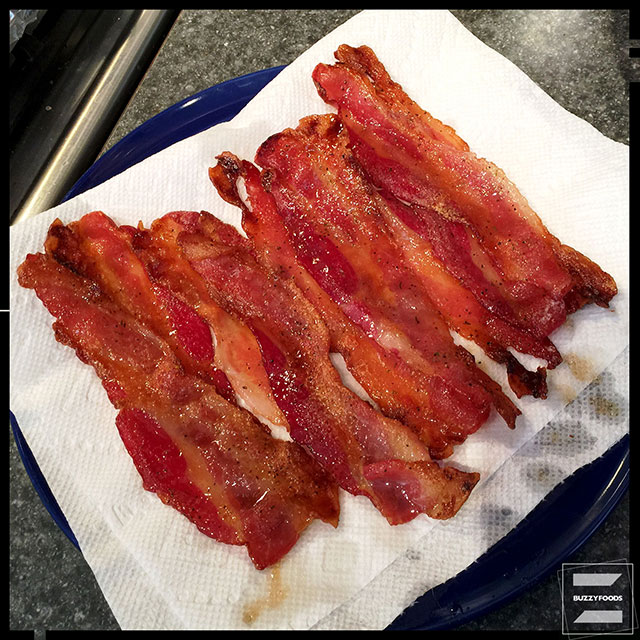
This screenshot has width=640, height=640. What are the coordinates of `plate` in the screenshot? It's located at (216, 100).